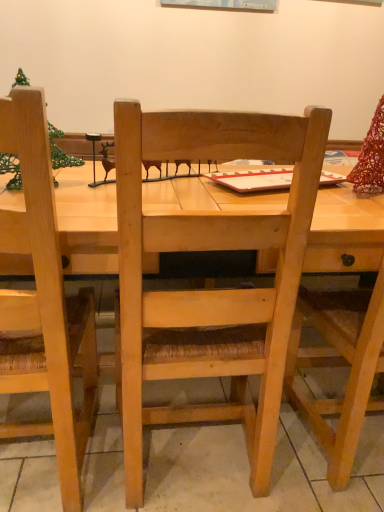
Question: Should I look upward or downward to see natural wood chair at left, marked as the second chair in a right-to-left arrangement?

Choices:
 (A) down
 (B) up

Answer: (A)

Question: Is natural wood chair at left, which is the 1th chair in left-to-right order, positioned far away from natural wood chair at center, the first chair when ordered from right to left?

Choices:
 (A) yes
 (B) no

Answer: (B)

Question: From a real-world perspective, is natural wood chair at left, which is the 1th chair in left-to-right order, located beneath natural wood chair at center, positioned as the second chair in left-to-right order?

Choices:
 (A) yes
 (B) no

Answer: (B)

Question: Is natural wood chair at left, which is the 1th chair in left-to-right order, bigger than natural wood chair at center, positioned as the second chair in left-to-right order?

Choices:
 (A) no
 (B) yes

Answer: (A)

Question: Can you confirm if natural wood chair at left, marked as the second chair in a right-to-left arrangement, is wider than natural wood chair at center, positioned as the second chair in left-to-right order?

Choices:
 (A) no
 (B) yes

Answer: (A)

Question: Is natural wood chair at left, which is the 1th chair in left-to-right order, not within natural wood chair at center, positioned as the second chair in left-to-right order?

Choices:
 (A) yes
 (B) no

Answer: (B)

Question: Is natural wood chair at left, which is the 1th chair in left-to-right order, beside natural wood chair at center, positioned as the second chair in left-to-right order?

Choices:
 (A) yes
 (B) no

Answer: (B)

Question: From the image's perspective, would you say natural wood chair at center, the first chair when ordered from right to left, is shown under natural wood chair at left, marked as the second chair in a right-to-left arrangement?

Choices:
 (A) no
 (B) yes

Answer: (A)

Question: Are natural wood chair at center, positioned as the second chair in left-to-right order, and natural wood chair at left, which is the 1th chair in left-to-right order, far apart?

Choices:
 (A) yes
 (B) no

Answer: (B)

Question: Does natural wood chair at center, positioned as the second chair in left-to-right order, appear on the left side of natural wood chair at left, which is the 1th chair in left-to-right order?

Choices:
 (A) no
 (B) yes

Answer: (A)

Question: Considering the relative positions of natural wood chair at center, the first chair when ordered from right to left, and natural wood chair at left, which is the 1th chair in left-to-right order, in the image provided, is natural wood chair at center, the first chair when ordered from right to left, in front of natural wood chair at left, which is the 1th chair in left-to-right order,?

Choices:
 (A) yes
 (B) no

Answer: (B)

Question: Is natural wood chair at center, positioned as the second chair in left-to-right order, oriented towards natural wood chair at left, which is the 1th chair in left-to-right order?

Choices:
 (A) no
 (B) yes

Answer: (B)

Question: Are natural wood chair at center, positioned as the second chair in left-to-right order, and natural wood chair at left, which is the 1th chair in left-to-right order, making contact?

Choices:
 (A) no
 (B) yes

Answer: (A)

Question: Is point (193, 291) closer or farther from the camera than point (23, 218)?

Choices:
 (A) farther
 (B) closer

Answer: (A)